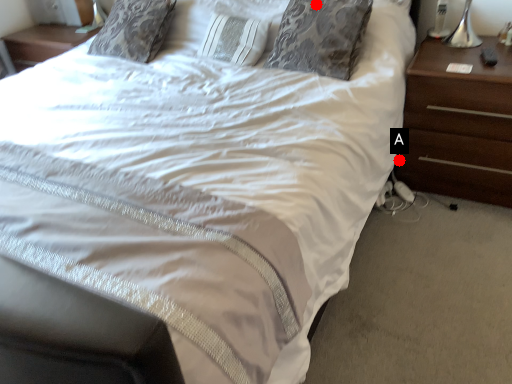
Question: Two points are circled on the image, labeled by A and B beside each circle. Which of the following is the closest to the observer?

Choices:
 (A) A is closer
 (B) B is closer

Answer: (B)